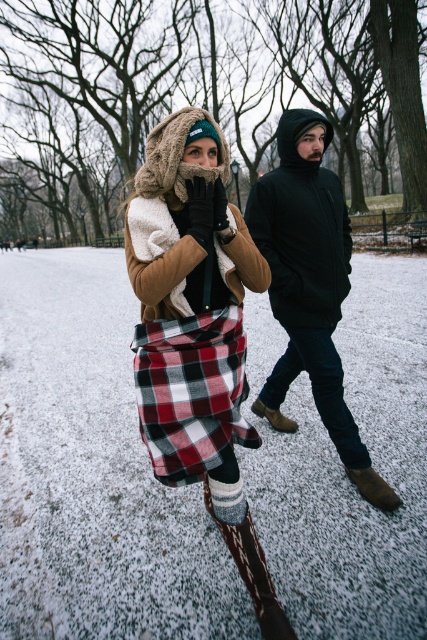
Who is more distant from viewer, (142, 433) or (362, 474)?

Positioned behind is point (362, 474).

Between point (198, 474) and point (350, 472), which one is positioned in front?

Point (198, 474) is in front.

The width and height of the screenshot is (427, 640). In order to click on plaid fabric kilt at center in this screenshot , I will do `click(192, 392)`.

The image size is (427, 640). What do you see at coordinates (196, 332) in the screenshot?
I see `plaid fabric skirt at center` at bounding box center [196, 332].

This screenshot has width=427, height=640. Identify the location of plaid fabric skirt at center. (196, 332).

Find the location of a particular element. The height and width of the screenshot is (640, 427). plaid fabric skirt at center is located at coordinates (196, 332).

Does black matte jacket at center lie behind brown suede boot at lower center?

No, it is not.

Is black matte jacket at center closer to the viewer compared to brown suede boot at lower center?

That is True.

Locate an element on the screen. This screenshot has height=640, width=427. black matte jacket at center is located at coordinates (306, 275).